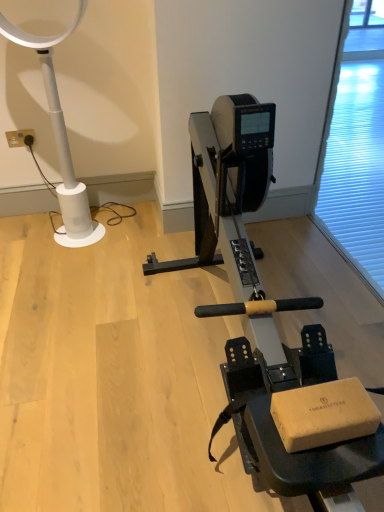
Find the location of a particular element. unoccupied space behind white plastic lamp at left is located at coordinates point(112,210).